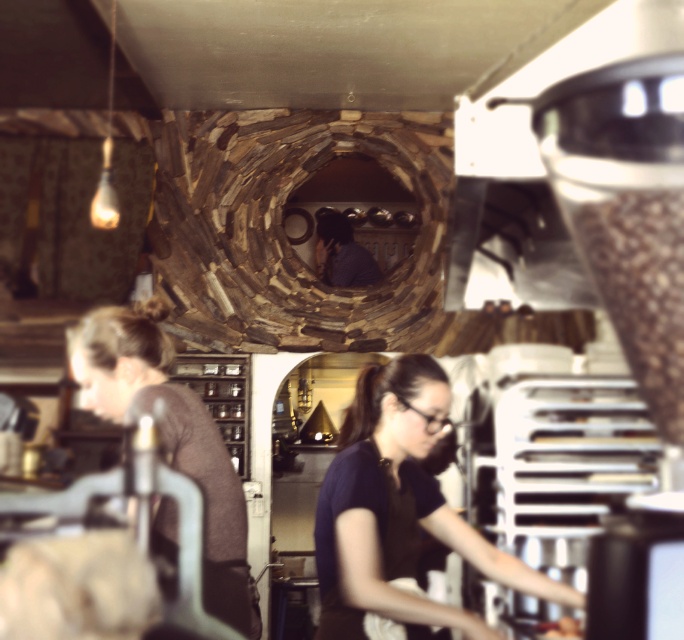
You are a customer at this cozy bakery and you see both the black matte apron at lower center and the matte brown hair at left. Which of these two items is positioned more to the right side of the scene?

The black matte apron at lower center is positioned to the right of the matte brown hair at left, so the black matte apron at lower center is more to the right side of the scene.

You are a customer entering the cozy cafe and notice the black matte apron at lower center and the matte brown hair at left. Which of these two items is wider?

The black matte apron at lower center is wider than the matte brown hair at left.